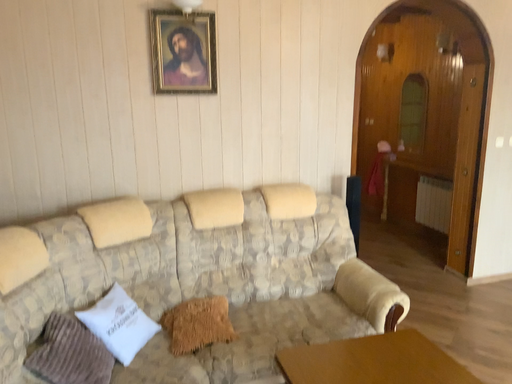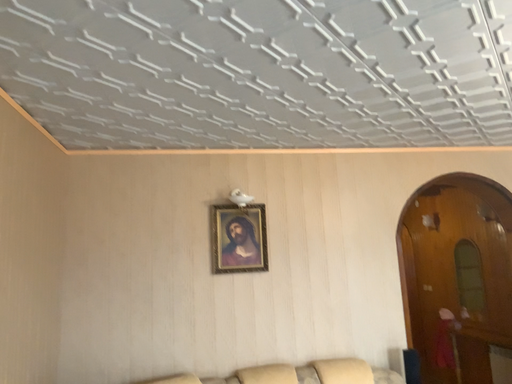
Question: Which way did the camera rotate in the video?

Choices:
 (A) rotated left
 (B) rotated right

Answer: (A)